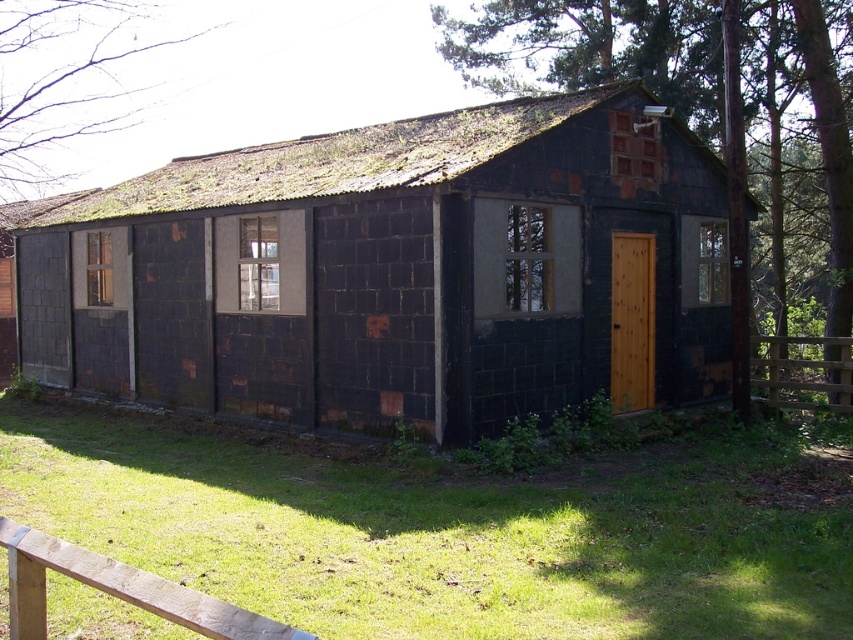
Question: Considering the real-world distances, which object is closest to the wooden gate at right?

Choices:
 (A) bare branches at upper left
 (B) rusty metal shed at center
 (C) rusty metal cabin at center

Answer: (C)

Question: Among these points, which one is farthest from the camera?

Choices:
 (A) (564, 116)
 (B) (134, 4)
 (C) (766, 374)

Answer: (B)

Question: Does rusty metal shed at center have a greater width compared to wooden gate at right?

Choices:
 (A) no
 (B) yes

Answer: (B)

Question: Is rusty corrugated metal roof at upper center positioned in front of bare branches at upper left?

Choices:
 (A) yes
 (B) no

Answer: (A)

Question: Which point is farther from the camera taking this photo?

Choices:
 (A) (796, 374)
 (B) (618, 228)
 (C) (12, 496)
 (D) (248, 163)

Answer: (A)

Question: Is rusty metal cabin at center behind bare branches at upper left?

Choices:
 (A) no
 (B) yes

Answer: (A)